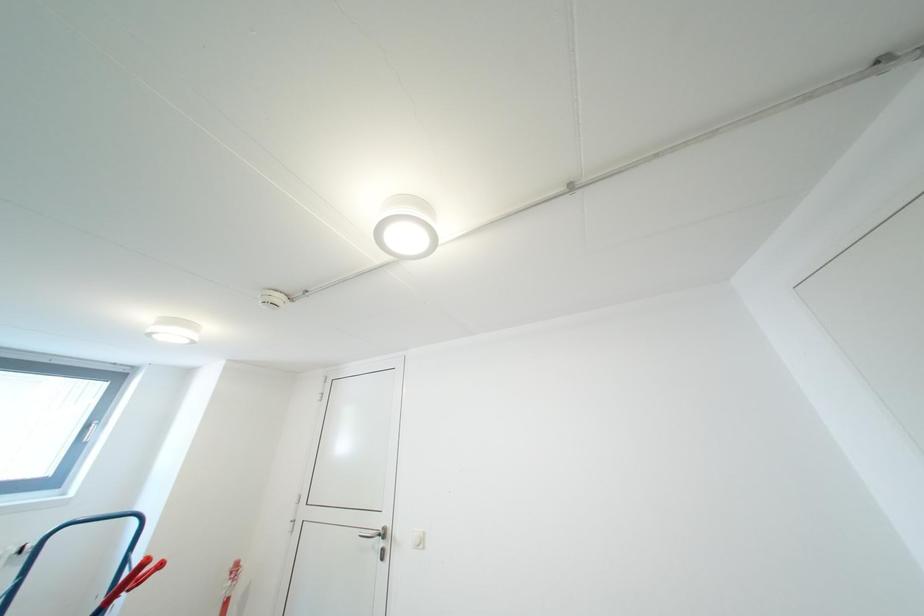
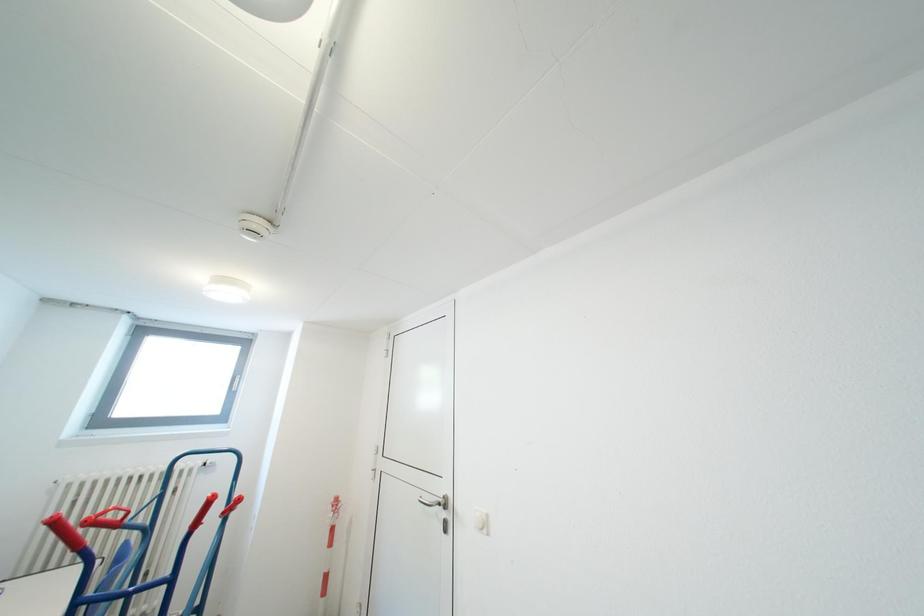
Question: Which direction would the cameraman need to move to produce the second image? Reply with the corresponding letter.

Choices:
 (A) Left
 (B) Right
 (C) Forward
 (D) Backward

Answer: (C)